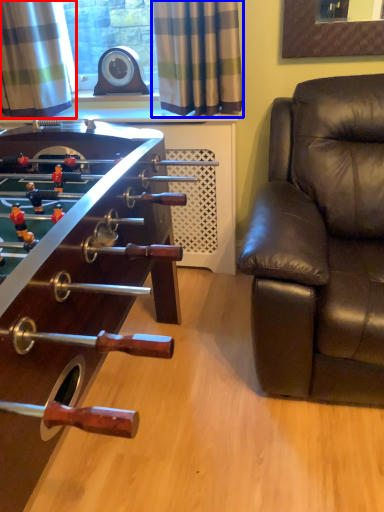
Question: Which of the following is the farthest to the observer, curtain (highlighted by a red box) or curtain (highlighted by a blue box)?

Choices:
 (A) curtain
 (B) curtain

Answer: (A)